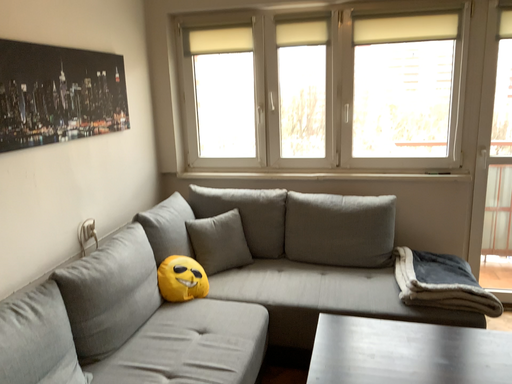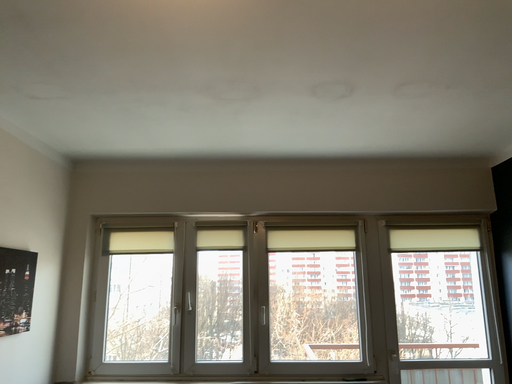
Question: Which way did the camera rotate in the video?

Choices:
 (A) rotated right
 (B) rotated left

Answer: (A)